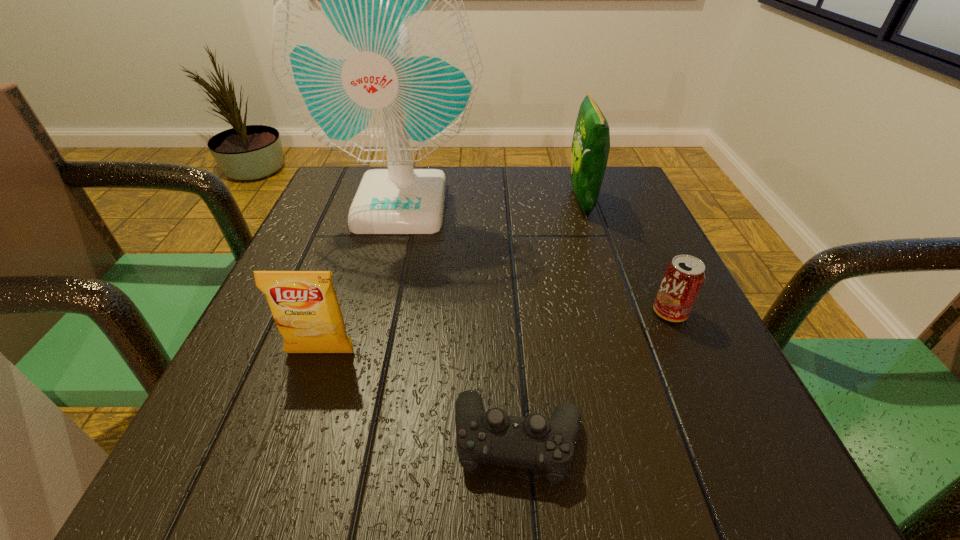
This screenshot has height=540, width=960. In order to click on the tallest object in this screenshot , I will do `click(372, 49)`.

You are a GUI agent. You are given a task and a screenshot of the screen. Output one action in this format:
    pyautogui.click(x=<x>, y=<y>)
    Task: Click on the fourth shortest object
    This screenshot has height=540, width=960.
    Given the screenshot: What is the action you would take?
    pyautogui.click(x=591, y=141)

The width and height of the screenshot is (960, 540). I want to click on the right crisp (potato chip), so click(591, 141).

You are a GUI agent. You are given a task and a screenshot of the screen. Output one action in this format:
    pyautogui.click(x=<x>, y=<y>)
    Task: Click on the second nearest object
    The height and width of the screenshot is (540, 960).
    Given the screenshot: What is the action you would take?
    pyautogui.click(x=304, y=305)

You are a GUI agent. You are given a task and a screenshot of the screen. Output one action in this format:
    pyautogui.click(x=<x>, y=<y>)
    Task: Click on the nearer crisp (potato chip)
    The height and width of the screenshot is (540, 960).
    Given the screenshot: What is the action you would take?
    pyautogui.click(x=304, y=305)

The image size is (960, 540). I want to click on soda can, so click(684, 276).

You are a GUI agent. You are given a task and a screenshot of the screen. Output one action in this format:
    pyautogui.click(x=<x>, y=<y>)
    Task: Click on the second shortest object
    This screenshot has height=540, width=960.
    Given the screenshot: What is the action you would take?
    pyautogui.click(x=684, y=276)

Where is `control`? This screenshot has width=960, height=540. control is located at coordinates 534,442.

The image size is (960, 540). Find the location of `the shortest object`. the shortest object is located at coordinates (534, 442).

The width and height of the screenshot is (960, 540). In order to click on blank space located in front of the fan to face the airflow in this screenshot , I will do (378, 295).